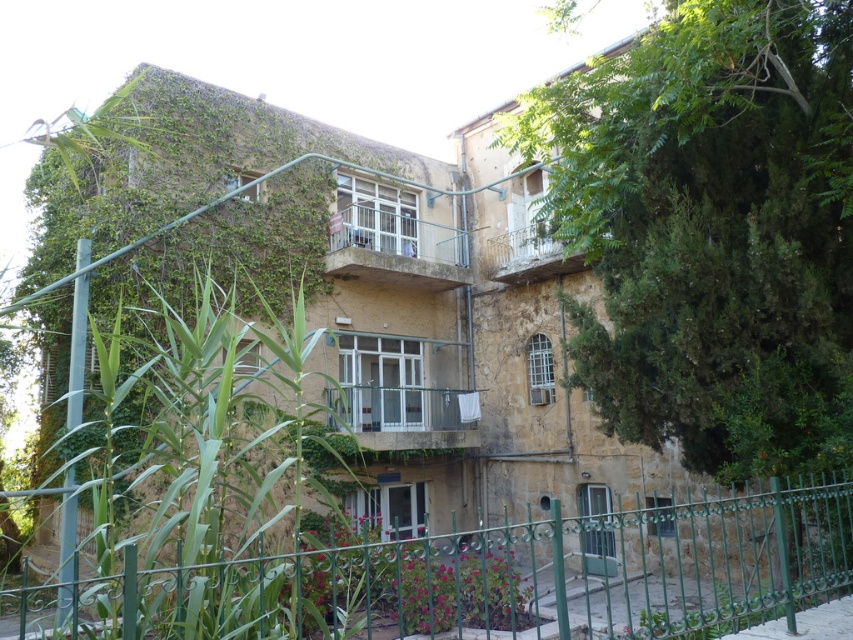
Does green metal fence at lower center appear over metallic white balcony at center?

Actually, green metal fence at lower center is below metallic white balcony at center.

Is green metal fence at lower center further to the viewer compared to metallic white balcony at center?

No, green metal fence at lower center is in front of metallic white balcony at center.

Who is more distant from viewer, (189, 636) or (426, 253)?

The point (426, 253) is more distant.

I want to click on green metal fence at lower center, so click(x=495, y=577).

Can you confirm if metallic white balcony at center is bigger than white wrought iron balcony at upper center?

Yes.

How much distance is there between metallic white balcony at center and white wrought iron balcony at upper center?

metallic white balcony at center is 2.02 meters from white wrought iron balcony at upper center.

I want to click on metallic white balcony at center, so click(396, 250).

Find the location of a particular element. metallic white balcony at center is located at coordinates (396, 250).

How much distance is there between green metal fence at lower center and white wrought iron balcony at upper center?

green metal fence at lower center and white wrought iron balcony at upper center are 6.23 meters apart.

Is green metal fence at lower center smaller than white wrought iron balcony at upper center?

No, green metal fence at lower center is not smaller than white wrought iron balcony at upper center.

Where is `green metal fence at lower center`? The width and height of the screenshot is (853, 640). green metal fence at lower center is located at coordinates (495, 577).